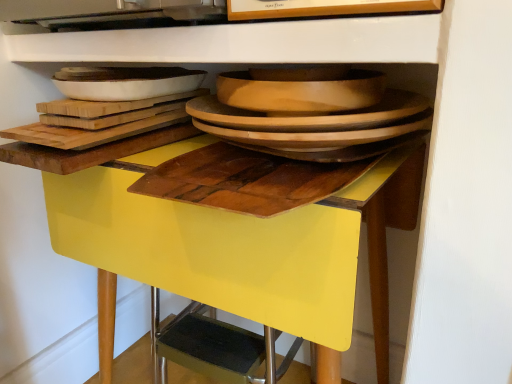
Question: Does yellow glossy table at center have a smaller size compared to white glossy platter at upper left, acting as the first platter starting from the left?

Choices:
 (A) no
 (B) yes

Answer: (A)

Question: From a real-world perspective, is yellow glossy table at center positioned over white glossy platter at upper left, acting as the first platter starting from the left, based on gravity?

Choices:
 (A) no
 (B) yes

Answer: (A)

Question: From a real-world perspective, is yellow glossy table at center located beneath white glossy platter at upper left, acting as the first platter starting from the left?

Choices:
 (A) yes
 (B) no

Answer: (A)

Question: Does yellow glossy table at center lie in front of white glossy platter at upper left, acting as the first platter starting from the left?

Choices:
 (A) yes
 (B) no

Answer: (A)

Question: Would you consider yellow glossy table at center to be distant from white glossy platter at upper left, acting as the first platter starting from the left?

Choices:
 (A) no
 (B) yes

Answer: (A)

Question: Would you say wooden cutting board at center is inside or outside yellow glossy table at center?

Choices:
 (A) inside
 (B) outside

Answer: (B)

Question: Visually, is wooden cutting board at center positioned to the left or to the right of yellow glossy table at center?

Choices:
 (A) left
 (B) right

Answer: (B)

Question: Looking at the image, does wooden cutting board at center seem bigger or smaller compared to yellow glossy table at center?

Choices:
 (A) big
 (B) small

Answer: (B)

Question: Is wooden cutting board at center taller or shorter than yellow glossy table at center?

Choices:
 (A) tall
 (B) short

Answer: (B)

Question: From their relative heights in the image, would you say wooden platter at center, acting as the 1th platter starting from the right, is taller or shorter than white glossy platter at upper left, which is the 2th platter from right to left?

Choices:
 (A) short
 (B) tall

Answer: (B)

Question: In the image, is wooden platter at center, the second platter in the left-to-right sequence, positioned in front of or behind white glossy platter at upper left, which is the 2th platter from right to left?

Choices:
 (A) behind
 (B) front

Answer: (B)

Question: Would you say wooden platter at center, the second platter in the left-to-right sequence, is to the left or to the right of white glossy platter at upper left, acting as the first platter starting from the left, in the picture?

Choices:
 (A) right
 (B) left

Answer: (A)

Question: Is wooden platter at center, the second platter in the left-to-right sequence, spatially inside white glossy platter at upper left, acting as the first platter starting from the left, or outside of it?

Choices:
 (A) inside
 (B) outside

Answer: (B)

Question: In terms of size, does yellow glossy table at center appear bigger or smaller than wooden cutting board at center?

Choices:
 (A) small
 (B) big

Answer: (B)

Question: Is yellow glossy table at center in front of or behind wooden cutting board at center in the image?

Choices:
 (A) behind
 (B) front

Answer: (A)